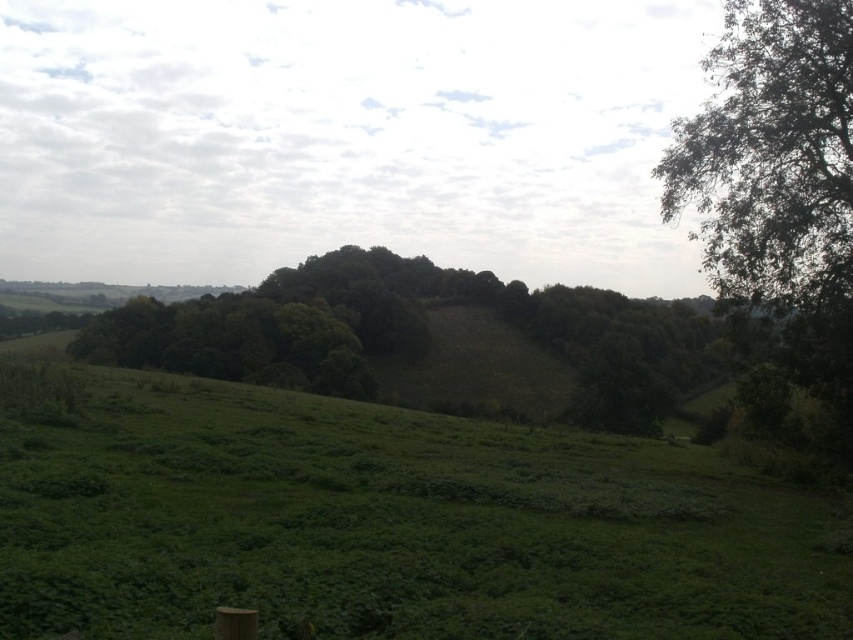
Does point (665, 170) lie in front of point (137, 316)?

That is True.

Locate an element on the screen. The image size is (853, 640). green leafy tree at right is located at coordinates (778, 195).

Which is in front, point (817, 340) or point (581, 330)?

Positioned in front is point (817, 340).

What are the coordinates of `green leafy tree at right` in the screenshot? It's located at (778, 195).